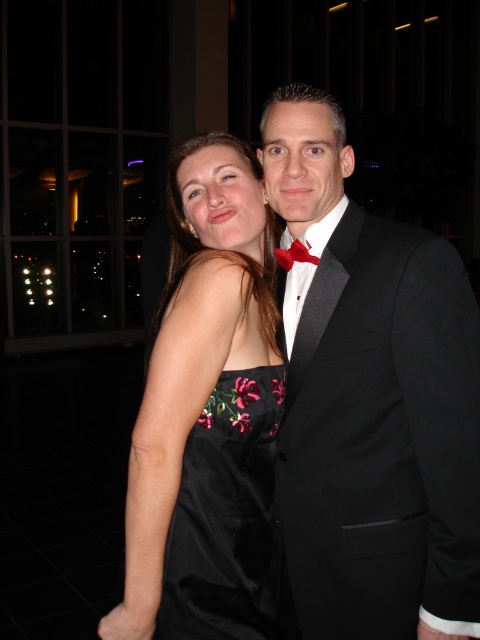
Question: Does satin black dress at center appear on the right side of black satin dress at center?

Choices:
 (A) yes
 (B) no

Answer: (B)

Question: Considering the relative positions of satin black dress at center and black satin dress at center in the image provided, where is satin black dress at center located with respect to black satin dress at center?

Choices:
 (A) above
 (B) below

Answer: (A)

Question: Which point appears closest to the camera in this image?

Choices:
 (A) (230, 477)
 (B) (241, 372)
 (C) (282, 250)
 (D) (350, 436)

Answer: (B)

Question: Which object is farther from the camera taking this photo?

Choices:
 (A) black satin dress at center
 (B) satin black dress at center
 (C) matte black bow tie at center

Answer: (C)

Question: Can you confirm if black satin tuxedo at center is positioned below black satin dress at center?

Choices:
 (A) no
 (B) yes

Answer: (A)

Question: Which point appears closest to the camera in this image?

Choices:
 (A) (227, 413)
 (B) (183, 564)

Answer: (B)